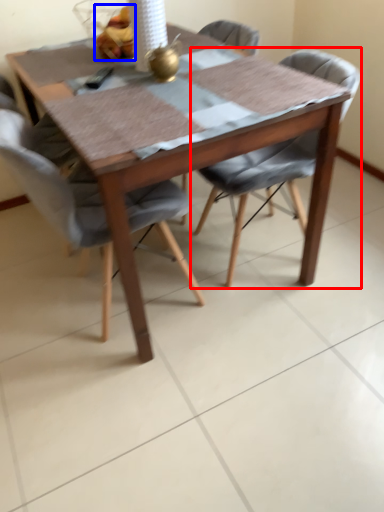
Question: Among these objects, which one is nearest to the camera, chair (highlighted by a red box) or food (highlighted by a blue box)?

Choices:
 (A) chair
 (B) food

Answer: (A)